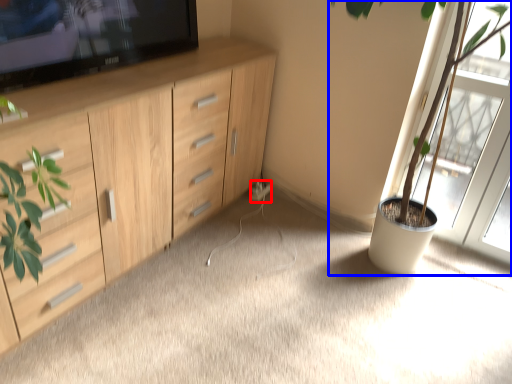
Question: Which object is further to the camera taking this photo, electric outlet (highlighted by a red box) or houseplant (highlighted by a blue box)?

Choices:
 (A) electric outlet
 (B) houseplant

Answer: (A)